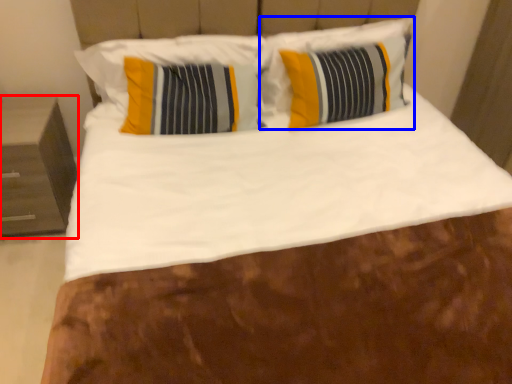
Question: Which object appears closest to the camera in this image, nightstand (highlighted by a red box) or pillow (highlighted by a blue box)?

Choices:
 (A) nightstand
 (B) pillow

Answer: (A)